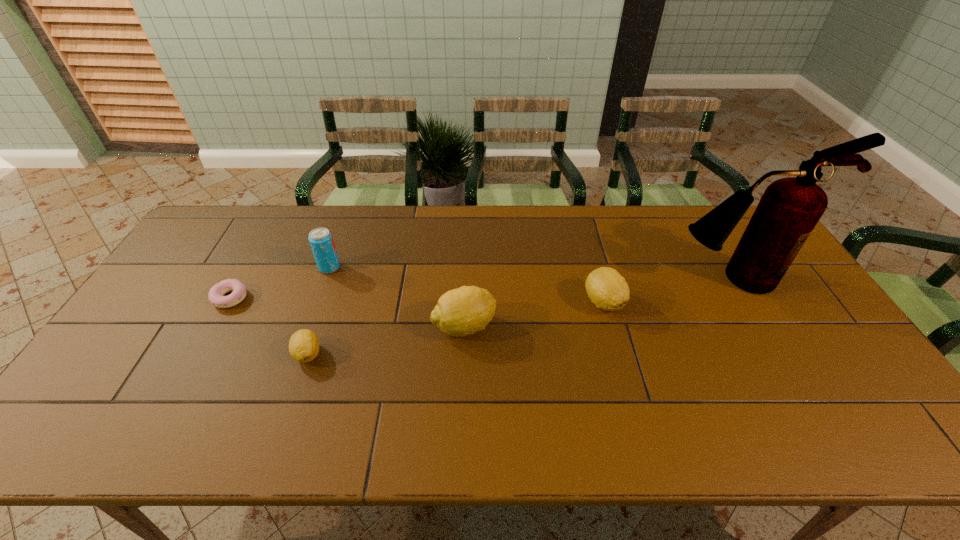
Image resolution: width=960 pixels, height=540 pixels. I want to click on vacant space located 0.100m at the stem end of the leftmost lemon, so click(290, 406).

This screenshot has height=540, width=960. What are the coordinates of `free space located at the stem end of the second lemon from right to left` in the screenshot? It's located at (619, 326).

You are a GUI agent. You are given a task and a screenshot of the screen. Output one action in this format:
    pyautogui.click(x=<x>, y=<y>)
    Task: Click on the vacant space located 0.200m at the stem end of the fifth object from left to right
    This screenshot has width=960, height=540.
    Given the screenshot: What is the action you would take?
    pyautogui.click(x=626, y=383)

Where is `blank area located on the right of the soda can`? This screenshot has width=960, height=540. blank area located on the right of the soda can is located at coordinates (433, 267).

Find the location of a particular element. This screenshot has width=960, height=540. free space located at the nozzle of the tallest object is located at coordinates (772, 345).

Find the location of a particular element. The image size is (960, 540). vacant area situated on the back of the doughnut is located at coordinates (257, 249).

What are the coordinates of `object present at the right edge` in the screenshot? It's located at (790, 208).

In the image, there is a desktop. Identify the location of free space at the far edge. Image resolution: width=960 pixels, height=540 pixels. (425, 247).

Locate an element on the screen. The height and width of the screenshot is (540, 960). free region at the near edge of the desktop is located at coordinates (776, 397).

Where is `vacant space at the left edge of the desktop`? The height and width of the screenshot is (540, 960). vacant space at the left edge of the desktop is located at coordinates (193, 280).